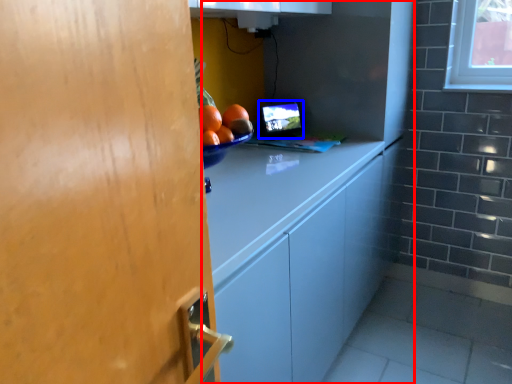
Question: Which object appears closest to the camera in this image, cabinetry (highlighted by a red box) or computer monitor (highlighted by a blue box)?

Choices:
 (A) cabinetry
 (B) computer monitor

Answer: (A)